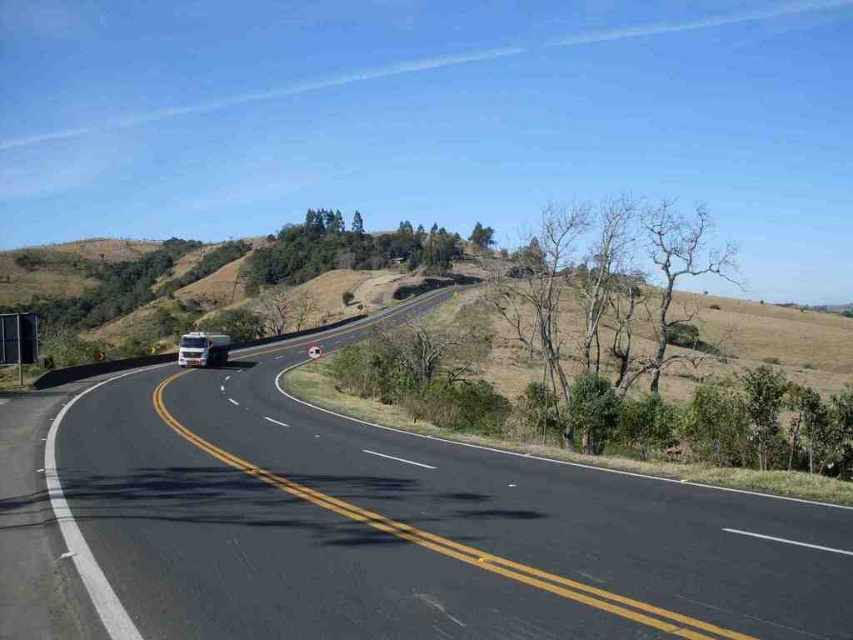
Question: Considering the relative positions of black asphalt highway at center and white glossy truck at center in the image provided, where is black asphalt highway at center located with respect to white glossy truck at center?

Choices:
 (A) right
 (B) left

Answer: (A)

Question: Among these points, which one is nearest to the camera?

Choices:
 (A) (215, 337)
 (B) (645, 572)

Answer: (B)

Question: Does black asphalt highway at center have a lesser width compared to white glossy truck at center?

Choices:
 (A) yes
 (B) no

Answer: (B)

Question: Which point is farther from the camera taking this photo?

Choices:
 (A) [x=190, y=342]
 (B) [x=786, y=628]

Answer: (A)

Question: From the image, what is the correct spatial relationship of black asphalt highway at center in relation to white glossy truck at center?

Choices:
 (A) right
 (B) left

Answer: (A)